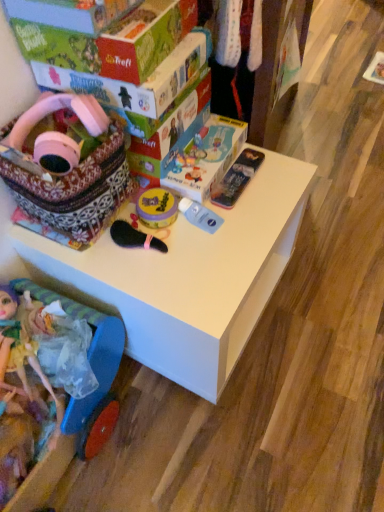
This screenshot has height=512, width=384. Find the location of `free point to the right of metallic plastic pencil case at upper right, which is the sixth toy from left to right`. free point to the right of metallic plastic pencil case at upper right, which is the sixth toy from left to right is located at coordinates (280, 180).